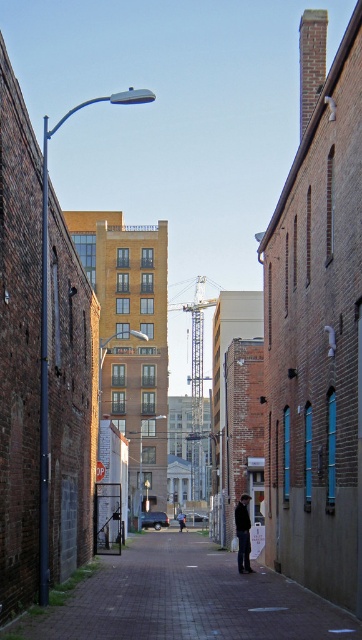
Question: Is metallic pole at left to the left of dark brown leather jacket at center from the viewer's perspective?

Choices:
 (A) no
 (B) yes

Answer: (B)

Question: Is dark brown leather jacket at center closer to the viewer compared to dark blue jeans at center?

Choices:
 (A) yes
 (B) no

Answer: (A)

Question: Can you confirm if paved brick pavement at center is wider than dark blue jeans at center?

Choices:
 (A) no
 (B) yes

Answer: (B)

Question: Which point is farther from the camera taking this photo?

Choices:
 (A) (251, 568)
 (B) (326, 339)
 (C) (182, 520)
 (D) (111, 637)

Answer: (C)

Question: Which object appears closest to the camera in this image?

Choices:
 (A) dark blue jeans at center
 (B) dark brown leather jacket at center
 (C) paved brick pavement at center
 (D) metallic pole at left

Answer: (D)

Question: Which point is closer to the camera taking this photo?

Choices:
 (A) (308, 488)
 (B) (2, 198)

Answer: (B)